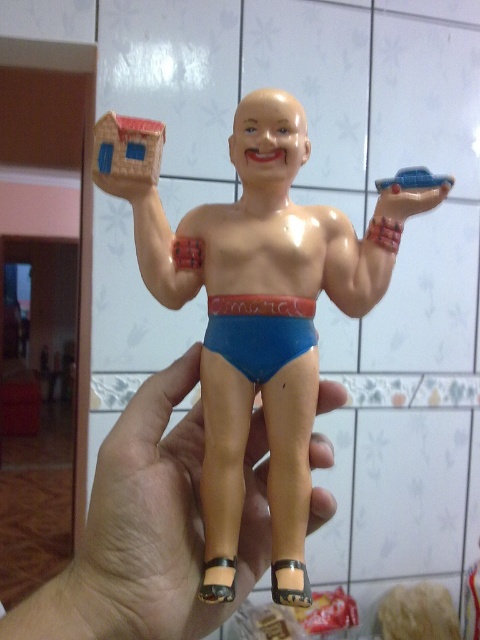
You are a person with an arm length of 60 centimeters. You want to reach and pick up the matte plastic toy at center from your current position. Can you do it without moving your feet?

The matte plastic toy at center is 52.24 centimeters away from the viewer. Since your arm length is 60 centimeters, which is longer than the distance, you can reach and pick up the matte plastic toy at center without moving your feet.

You are a photographer trying to capture the wrestler figurine. You notice two points on the figurine at coordinates point (256, 506) and point (404, 182). Which point is closer to the camera?

Point (404, 182) is closer to the camera than point (256, 506) because the Objects Description states that point (256, 506) is further away.